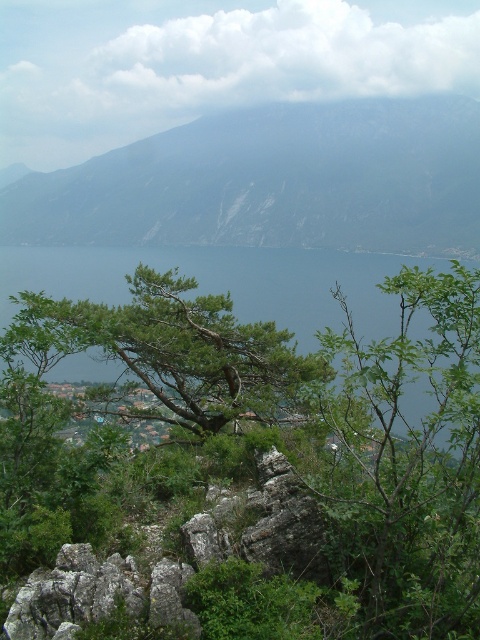
You are a hiker planning to take a photo of the rocky gray mountain at upper center. To ensure the mountain is centered in your shot, where should you position yourself relative to the mountain?

The rocky gray mountain at upper center is located at point (274, 180), so you should position yourself directly in front of it to center it in your photo.

You are a hiker planning to take a photo of the rocky gray mountain at upper center and the green leafy tree at center from the same spot. Which object will appear bigger in your photo?

The rocky gray mountain at upper center will appear bigger in the photo because it has a larger size compared to the green leafy tree at center.